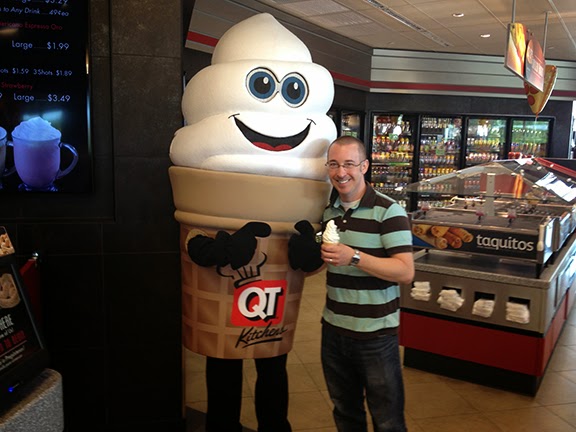
Image resolution: width=576 pixels, height=432 pixels. What are the coordinates of `beverage area` in the screenshot? It's located at (435, 146).